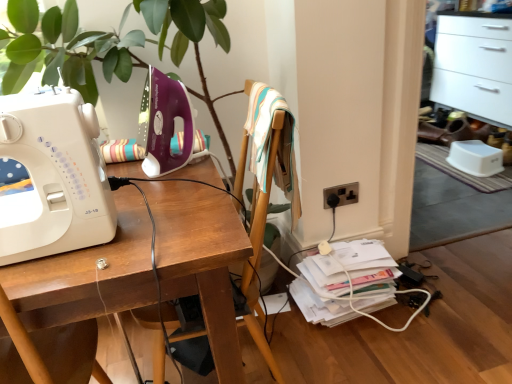
Question: Are purple plastic sewing machine at upper left, placed as the second sewing machine when sorted from front to back, and black plastic electric outlet at lower right making contact?

Choices:
 (A) no
 (B) yes

Answer: (A)

Question: Is purple plastic sewing machine at upper left, placed as the second sewing machine when sorted from front to back, facing towards black plastic electric outlet at lower right?

Choices:
 (A) no
 (B) yes

Answer: (A)

Question: Does purple plastic sewing machine at upper left, the 1th sewing machine when ordered from back to front, appear on the right side of black plastic electric outlet at lower right?

Choices:
 (A) no
 (B) yes

Answer: (A)

Question: Is the depth of purple plastic sewing machine at upper left, the 1th sewing machine when ordered from back to front, greater than that of black plastic electric outlet at lower right?

Choices:
 (A) no
 (B) yes

Answer: (A)

Question: Does purple plastic sewing machine at upper left, the 1th sewing machine when ordered from back to front, have a larger size compared to black plastic electric outlet at lower right?

Choices:
 (A) yes
 (B) no

Answer: (A)

Question: Visually, is wooden chair at center positioned to the left or to the right of white glossy file cabinet at upper right?

Choices:
 (A) left
 (B) right

Answer: (A)

Question: From their relative heights in the image, would you say wooden chair at center is taller or shorter than white glossy file cabinet at upper right?

Choices:
 (A) tall
 (B) short

Answer: (B)

Question: Choose the correct answer: Is wooden chair at center inside white glossy file cabinet at upper right or outside it?

Choices:
 (A) inside
 (B) outside

Answer: (B)

Question: Is point (279, 115) positioned closer to the camera than point (509, 34)?

Choices:
 (A) farther
 (B) closer

Answer: (B)

Question: In the image, is wooden desk at center positioned in front of or behind wooden chair at center?

Choices:
 (A) behind
 (B) front

Answer: (B)

Question: Considering the positions of wooden desk at center and wooden chair at center in the image, is wooden desk at center wider or thinner than wooden chair at center?

Choices:
 (A) wide
 (B) thin

Answer: (A)

Question: Does point (45, 307) appear closer or farther from the camera than point (147, 314)?

Choices:
 (A) closer
 (B) farther

Answer: (A)

Question: Visually, is wooden desk at center positioned to the left or to the right of wooden chair at center?

Choices:
 (A) left
 (B) right

Answer: (A)

Question: In the image, is purple plastic sewing machine at upper left, placed as the second sewing machine when sorted from front to back, positioned in front of or behind white plastic sewing machine at left, the 2th sewing machine viewed from the back?

Choices:
 (A) front
 (B) behind

Answer: (B)

Question: Visually, is purple plastic sewing machine at upper left, placed as the second sewing machine when sorted from front to back, positioned to the left or to the right of white plastic sewing machine at left, the 2th sewing machine viewed from the back?

Choices:
 (A) right
 (B) left

Answer: (A)